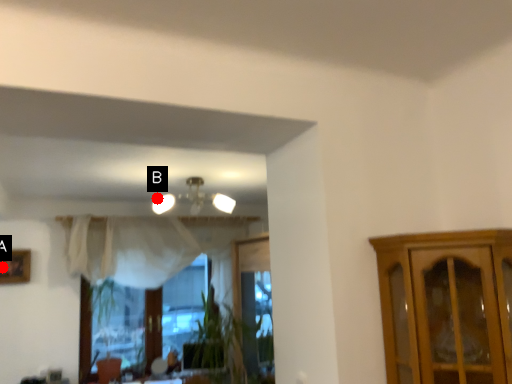
Question: Two points are circled on the image, labeled by A and B beside each circle. Among these points, which one is nearest to the camera?

Choices:
 (A) A is closer
 (B) B is closer

Answer: (A)